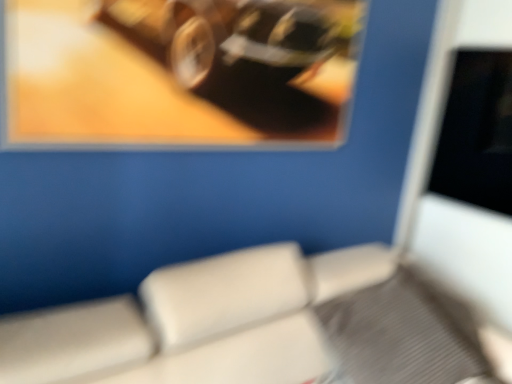
Question: Is the position of metallic reflective frame at upper left more distant than that of beige leather chair at lower center?

Choices:
 (A) no
 (B) yes

Answer: (B)

Question: From a real-world perspective, is metallic reflective frame at upper left beneath beige leather chair at lower center?

Choices:
 (A) no
 (B) yes

Answer: (A)

Question: From a real-world perspective, is metallic reflective frame at upper left positioned over beige leather chair at lower center based on gravity?

Choices:
 (A) yes
 (B) no

Answer: (A)

Question: Can you see metallic reflective frame at upper left touching beige leather chair at lower center?

Choices:
 (A) yes
 (B) no

Answer: (B)

Question: Is metallic reflective frame at upper left smaller than beige leather chair at lower center?

Choices:
 (A) yes
 (B) no

Answer: (A)

Question: Does metallic reflective frame at upper left turn towards beige leather chair at lower center?

Choices:
 (A) no
 (B) yes

Answer: (A)

Question: Can metallic reflective frame at upper left be found inside beige leather chair at lower center?

Choices:
 (A) no
 (B) yes

Answer: (A)

Question: From a real-world perspective, is beige leather chair at lower center over metallic reflective frame at upper left?

Choices:
 (A) yes
 (B) no

Answer: (B)

Question: Considering the relative sizes of beige leather chair at lower center and metallic reflective frame at upper left in the image provided, is beige leather chair at lower center shorter than metallic reflective frame at upper left?

Choices:
 (A) yes
 (B) no

Answer: (A)

Question: Considering the relative sizes of beige leather chair at lower center and metallic reflective frame at upper left in the image provided, is beige leather chair at lower center wider than metallic reflective frame at upper left?

Choices:
 (A) yes
 (B) no

Answer: (A)

Question: Is beige leather chair at lower center in contact with metallic reflective frame at upper left?

Choices:
 (A) yes
 (B) no

Answer: (B)

Question: Is beige leather chair at lower center oriented towards metallic reflective frame at upper left?

Choices:
 (A) yes
 (B) no

Answer: (B)

Question: Which is correct: metallic reflective frame at upper left is inside beige leather chair at lower center, or outside of it?

Choices:
 (A) outside
 (B) inside

Answer: (A)